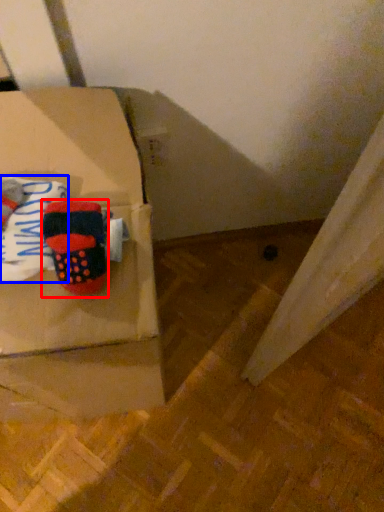
Question: Among these objects, which one is nearest to the camera, footwear (highlighted by a red box) or clothing (highlighted by a blue box)?

Choices:
 (A) footwear
 (B) clothing

Answer: (B)